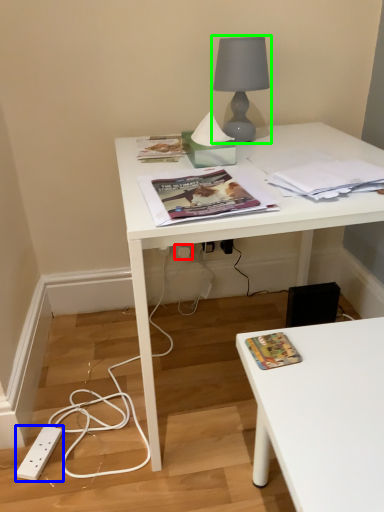
Question: Which object is positioned closest to electric outlet (highlighted by a red box)? Select from power plugs and sockets (highlighted by a blue box) and lamp (highlighted by a green box).

Choices:
 (A) power plugs and sockets
 (B) lamp

Answer: (B)